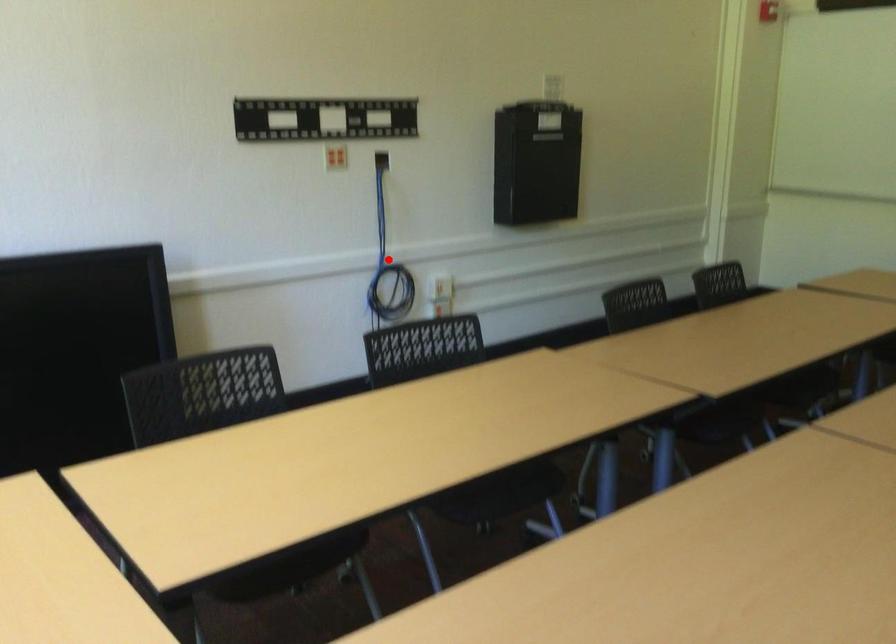
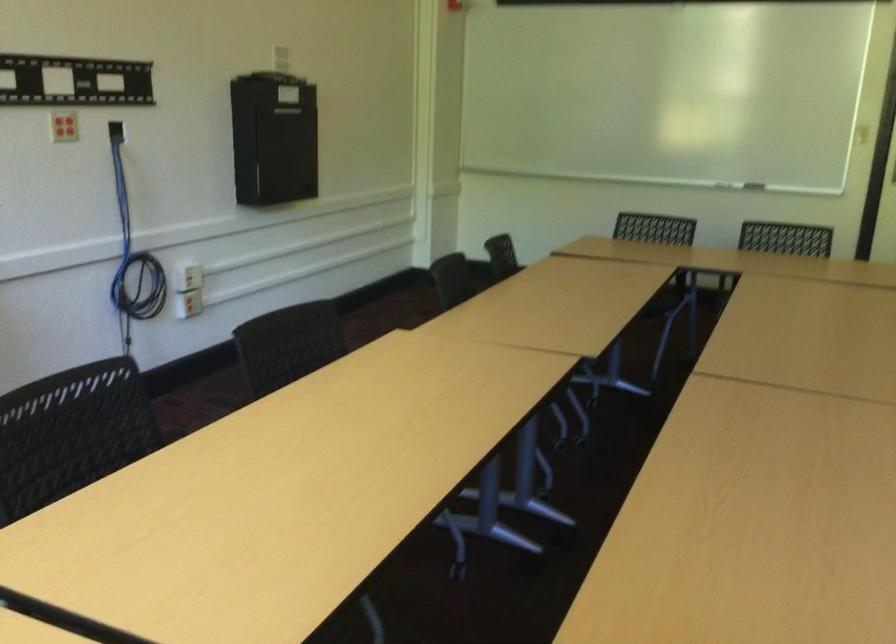
Question: I am providing you with two images of the same scene from different viewpoints. A red point is shown in image1. For the corresponding object point in image2, is it positioned nearer or farther from the camera?

Choices:
 (A) Nearer
 (B) Farther

Answer: (A)